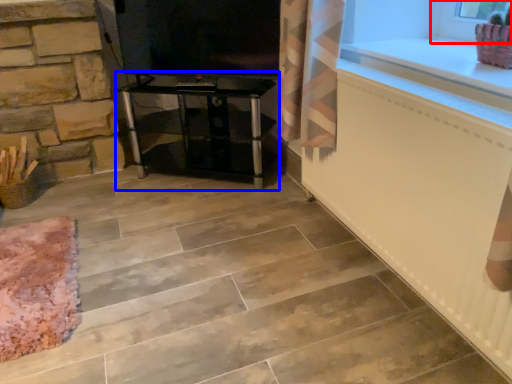
Question: Which object appears farthest to the camera in this image, window frame (highlighted by a red box) or furniture (highlighted by a blue box)?

Choices:
 (A) window frame
 (B) furniture

Answer: (B)